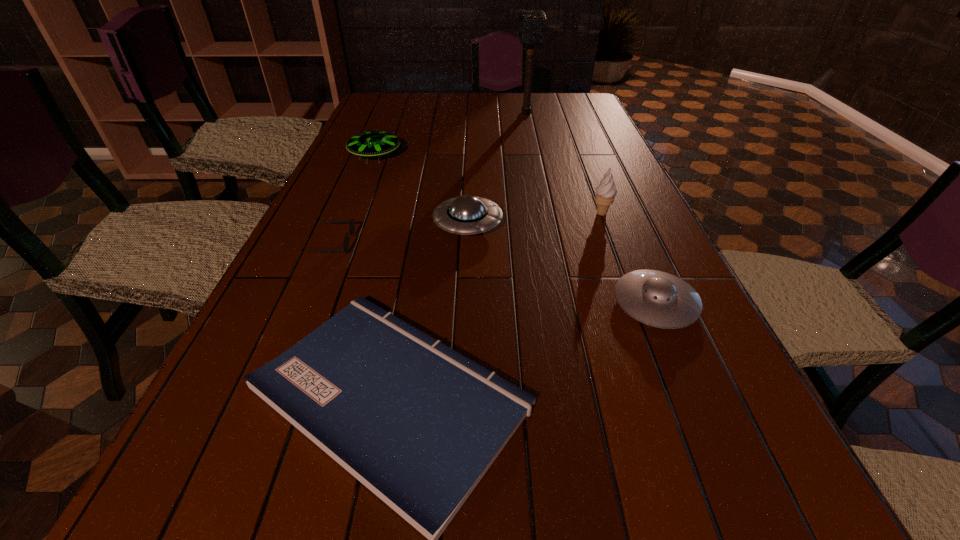
In the image, there is a desktop. Identify the location of vacant space at the far edge. pos(473,93).

Image resolution: width=960 pixels, height=540 pixels. I want to click on free region at the left edge of the desktop, so tap(265, 330).

Locate an element on the screen. The image size is (960, 540). free region at the right edge of the desktop is located at coordinates (579, 141).

This screenshot has width=960, height=540. Find the location of `unoccupied area between the mallet and the nearest saucer`. unoccupied area between the mallet and the nearest saucer is located at coordinates (590, 208).

The height and width of the screenshot is (540, 960). Identify the location of free space between the second saucer from left to right and the third object from right to left. (497, 168).

You are a GUI agent. You are given a task and a screenshot of the screen. Output one action in this format:
    pyautogui.click(x=<x>, y=<y>)
    Task: Click on the vacant point located between the second shortest object and the second nearest saucer
    
    Given the screenshot: What is the action you would take?
    pyautogui.click(x=400, y=234)

I want to click on vacant space in between the nearest saucer and the leftmost saucer, so click(x=516, y=230).

Locate an element on the screen. The width and height of the screenshot is (960, 540). free spot between the tallest object and the second saucer from left to right is located at coordinates (497, 168).

I want to click on vacant space that's between the farthest object and the second tallest object, so click(564, 163).

Choose which object is the fourth nearest neighbor to the farthest object. Please provide its 2D coordinates. Your answer should be formatted as a tuple, i.e. [(x, y)], where the tuple contains the x and y coordinates of a point satisfying the conditions above.

[(352, 223)]